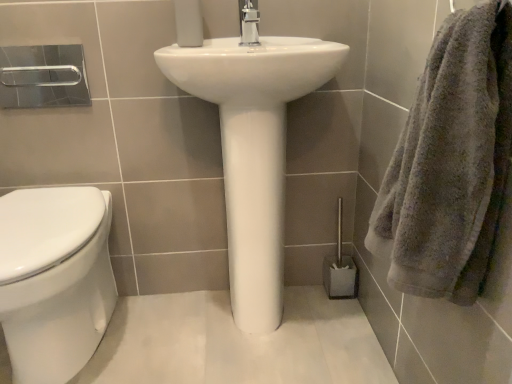
Locate an element on the screen. free region on the left part of gray plastic toilet brush at lower right is located at coordinates (304, 295).